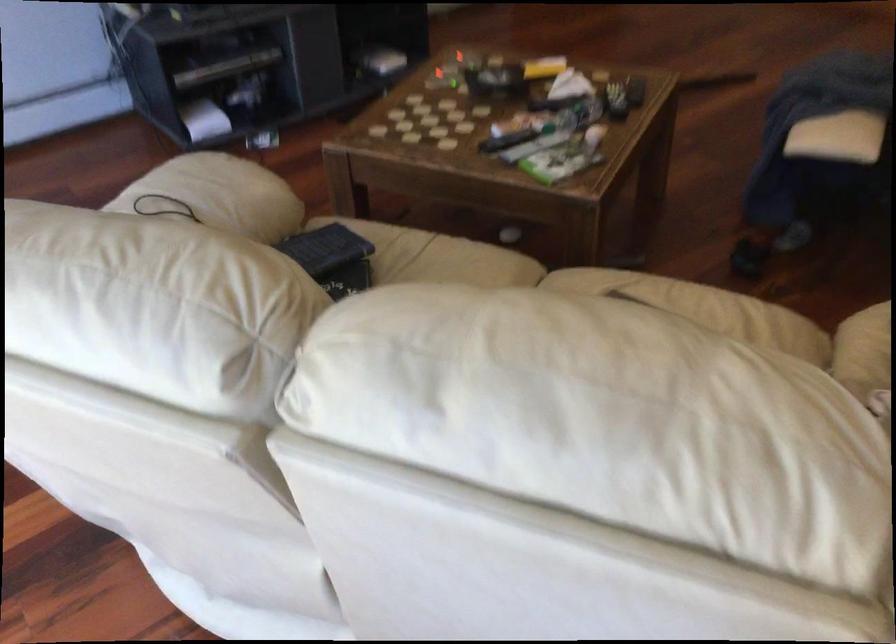
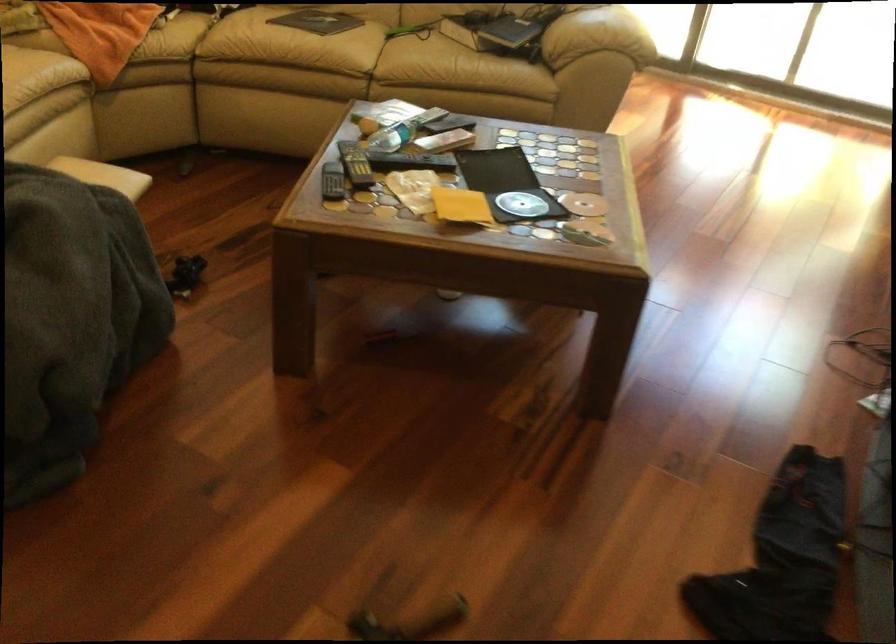
The point at (236,161) is marked in the first image. Where is the corresponding point in the second image?

(597, 35)